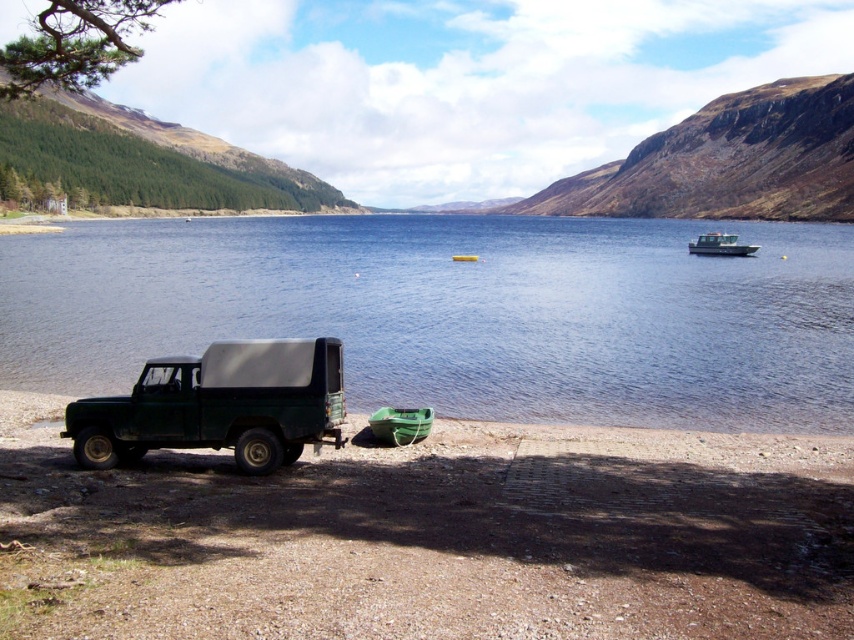
You are standing at the camera position and want to reach the white plastic boat at center. The maximum distance you can walk is 200 feet. Can you reach it without exceeding your walking limit?

The white plastic boat at center is 236.17 feet away from the camera, which exceeds your maximum walking distance of 200 feet. You cannot reach it without exceeding your limit.

You are a hiker planning to cross the lake using the green rubber boat at center. To launch the boat, you need to move it away from the green matte truck at lower left. Which direction should you move it?

Since the green matte truck at lower left is in front of the green rubber boat at center, you should move the green rubber boat at center backward away from the truck to launch it into the water.

You are planning to transport both the green matte truck at lower left and the green rubber boat at center onto a flatbed trailer. The trailer has a maximum width capacity of 2.5 meters. Based on their widths, can both items be placed side by side on the trailer without exceeding the width limit?

The green matte truck at lower left might be wider than the green rubber boat at center, so it is uncertain if both can fit side by side on the trailer without exceeding the 2.5 meters width limit. The exact widths are needed to determine this.